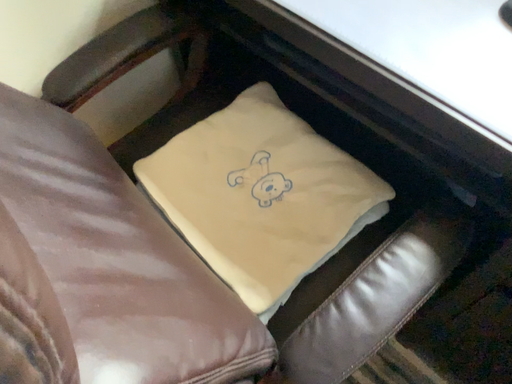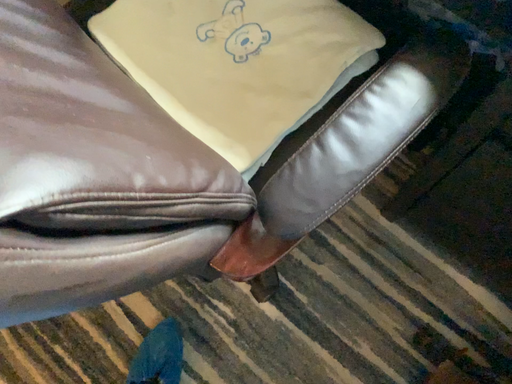
Question: How did the camera likely rotate when shooting the video?

Choices:
 (A) rotated downward
 (B) rotated upward

Answer: (A)